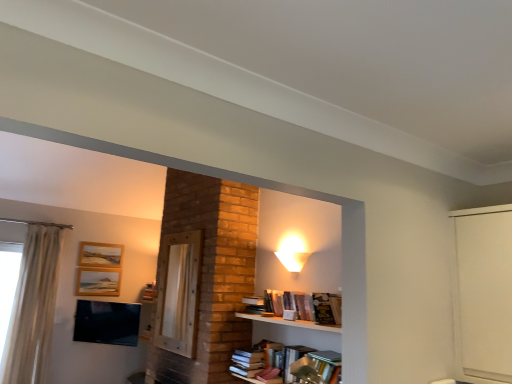
Describe the element at coordinates (106, 322) in the screenshot. I see `matte black tv at lower left` at that location.

What is the approximate height of white frosted glass lampshade at upper center?

white frosted glass lampshade at upper center is 9.31 inches in height.

Describe the element at coordinates (247, 362) in the screenshot. The image size is (512, 384). I see `hardcover books at center` at that location.

Find the location of a particular element. The image size is (512, 384). wooden picture frame at upper left, acting as the 2th picture frame starting from the bottom is located at coordinates (100, 254).

Is hardcover books at center not close to white frosted glass lampshade at upper center?

No, hardcover books at center is not far away from white frosted glass lampshade at upper center.

In terms of width, does hardcover books at center look wider or thinner when compared to white frosted glass lampshade at upper center?

Clearly, hardcover books at center has more width compared to white frosted glass lampshade at upper center.

Looking at this image, measure the distance from hardcover books at center to white frosted glass lampshade at upper center.

hardcover books at center and white frosted glass lampshade at upper center are 32.13 inches apart from each other.

Which is behind, point (243, 364) or point (288, 264)?

The point (288, 264) is farther.

Is white sheer curtain at left a part of matte black tv at lower left?

Answer: No, matte black tv at lower left does not contain white sheer curtain at left.

Which object is positioned more to the right, matte black tv at lower left or white sheer curtain at left?

matte black tv at lower left.

How far apart are matte black tv at lower left and white sheer curtain at left?

A distance of 58.07 centimeters exists between matte black tv at lower left and white sheer curtain at left.

Is matte black tv at lower left far from white sheer curtain at left?

No, matte black tv at lower left is not far away from white sheer curtain at left.

Is wooden picture frame at upper left, marked as the 1th picture frame in a top-to-bottom arrangement, with matte black tv at lower left?

No, wooden picture frame at upper left, marked as the 1th picture frame in a top-to-bottom arrangement, is not with matte black tv at lower left.

Which of these two, wooden picture frame at upper left, marked as the 1th picture frame in a top-to-bottom arrangement, or matte black tv at lower left, is bigger?

Bigger between the two is matte black tv at lower left.

Looking at this image, is wooden picture frame at upper left, marked as the 1th picture frame in a top-to-bottom arrangement, spatially inside matte black tv at lower left, or outside of it?

wooden picture frame at upper left, marked as the 1th picture frame in a top-to-bottom arrangement, is not inside matte black tv at lower left, it's outside.

From the image's perspective, which one is positioned higher, wooden picture frame at upper left, acting as the 2th picture frame starting from the bottom, or matte black tv at lower left?

wooden picture frame at upper left, acting as the 2th picture frame starting from the bottom.

In the scene shown: How much distance is there between wooden picture frame at upper left, acting as the 2th picture frame starting from the bottom, and white frosted glass lampshade at upper center?

wooden picture frame at upper left, acting as the 2th picture frame starting from the bottom, and white frosted glass lampshade at upper center are 2.82 meters apart from each other.

Would you say wooden picture frame at upper left, acting as the 2th picture frame starting from the bottom, is outside white frosted glass lampshade at upper center?

Indeed, wooden picture frame at upper left, acting as the 2th picture frame starting from the bottom, is completely outside white frosted glass lampshade at upper center.

Is wooden picture frame at upper left, marked as the 1th picture frame in a top-to-bottom arrangement, closer to the viewer compared to white frosted glass lampshade at upper center?

No, wooden picture frame at upper left, marked as the 1th picture frame in a top-to-bottom arrangement, is behind white frosted glass lampshade at upper center.

Is wooden picture frame at upper left, marked as the 1th picture frame in a top-to-bottom arrangement, wider or thinner than white frosted glass lampshade at upper center?

In the image, wooden picture frame at upper left, marked as the 1th picture frame in a top-to-bottom arrangement, appears to be more narrow than white frosted glass lampshade at upper center.

At what (x,y) coordinates should I click in order to perform the action: click on the 2nd picture frame counting from the right of the white sheer curtain at left. Please return your answer as a coordinate pair (x, y). Looking at the image, I should click on (98, 281).

Which of these two, white sheer curtain at left or wooden picture frame at upper left, which appears as the 1th picture frame when ordered from the bottom, stands taller?

With more height is white sheer curtain at left.

From a real-world perspective, between white sheer curtain at left and wooden picture frame at upper left, which is the second picture frame in top-to-bottom order, who is vertically higher?

wooden picture frame at upper left, which is the second picture frame in top-to-bottom order.

Measure the distance from wooden picture frame at upper left, which appears as the 1th picture frame when ordered from the bottom, to hardcover books at center.

They are 8.24 feet apart.

Does wooden picture frame at upper left, which appears as the 1th picture frame when ordered from the bottom, have a greater height compared to hardcover books at center?

Indeed, wooden picture frame at upper left, which appears as the 1th picture frame when ordered from the bottom, has a greater height compared to hardcover books at center.

In terms of size, does wooden picture frame at upper left, which is the second picture frame in top-to-bottom order, appear bigger or smaller than hardcover books at center?

Considering their sizes, wooden picture frame at upper left, which is the second picture frame in top-to-bottom order, takes up less space than hardcover books at center.

From a real-world perspective, is wooden picture frame at upper left, which appears as the 1th picture frame when ordered from the bottom, positioned under hardcover books at center based on gravity?

No.

Considering the sizes of wooden picture frame at upper left, which appears as the 1th picture frame when ordered from the bottom, and white sheer curtain at left in the image, is wooden picture frame at upper left, which appears as the 1th picture frame when ordered from the bottom, taller or shorter than white sheer curtain at left?

Considering their sizes, wooden picture frame at upper left, which appears as the 1th picture frame when ordered from the bottom, has less height than white sheer curtain at left.

Can you tell me how much wooden picture frame at upper left, which appears as the 1th picture frame when ordered from the bottom, and white sheer curtain at left differ in facing direction?

The angular difference between wooden picture frame at upper left, which appears as the 1th picture frame when ordered from the bottom, and white sheer curtain at left is 0.00266 degrees.

From the white sheer curtain at left, count 1st picture frames backward and point to it. Please provide its 2D coordinates.

[(98, 281)]

In the scene shown: Are wooden picture frame at upper left, which is the second picture frame in top-to-bottom order, and white sheer curtain at left beside each other?

wooden picture frame at upper left, which is the second picture frame in top-to-bottom order, and white sheer curtain at left are clearly separated.

Image resolution: width=512 pixels, height=384 pixels. I want to click on book that is below the white frosted glass lampshade at upper center (from the image's perspective), so click(247, 362).

You are a GUI agent. You are given a task and a screenshot of the screen. Output one action in this format:
    pyautogui.click(x=<x>, y=<y>)
    Task: Click on the curtain above the matte black tv at lower left (from a real-world perspective)
    The height and width of the screenshot is (384, 512).
    Given the screenshot: What is the action you would take?
    pyautogui.click(x=33, y=308)

Based on their spatial positions, is white frosted glass lampshade at upper center or matte black tv at lower left further from white sheer curtain at left?

Among the two, white frosted glass lampshade at upper center is located further to white sheer curtain at left.

Which object lies further to the anchor point matte black tv at lower left, white sheer curtain at left or wooden picture frame at upper left, which is the second picture frame in top-to-bottom order?

white sheer curtain at left.

Estimate the real-world distances between objects in this image. Which object is further from wooden picture frame at upper left, which appears as the 1th picture frame when ordered from the bottom, hardcover books at center or matte black tv at lower left?

Among the two, hardcover books at center is located further to wooden picture frame at upper left, which appears as the 1th picture frame when ordered from the bottom.

Which object lies nearer to the anchor point wooden picture frame at upper left, marked as the 1th picture frame in a top-to-bottom arrangement, wooden picture frame at upper left, which appears as the 1th picture frame when ordered from the bottom, or hardcover books at center?

wooden picture frame at upper left, which appears as the 1th picture frame when ordered from the bottom, lies closer to wooden picture frame at upper left, marked as the 1th picture frame in a top-to-bottom arrangement, than the other object.

Estimate the real-world distances between objects in this image. Which object is further from white sheer curtain at left, white frosted glass lampshade at upper center or hardcover books at center?

white frosted glass lampshade at upper center is positioned further to the anchor white sheer curtain at left.

Considering their positions, is matte black tv at lower left positioned closer to white frosted glass lampshade at upper center than white sheer curtain at left?

Based on the image, matte black tv at lower left appears to be nearer to white frosted glass lampshade at upper center.

Looking at the image, which one is located further to wooden picture frame at upper left, marked as the 1th picture frame in a top-to-bottom arrangement, white frosted glass lampshade at upper center or wooden picture frame at upper left, which appears as the 1th picture frame when ordered from the bottom?

white frosted glass lampshade at upper center is positioned further to the anchor wooden picture frame at upper left, marked as the 1th picture frame in a top-to-bottom arrangement.

Estimate the real-world distances between objects in this image. Which object is closer to wooden picture frame at upper left, which appears as the 1th picture frame when ordered from the bottom, white sheer curtain at left or matte black tv at lower left?

The object closer to wooden picture frame at upper left, which appears as the 1th picture frame when ordered from the bottom, is matte black tv at lower left.

Identify the location of picture frame between white sheer curtain at left and wooden picture frame at upper left, marked as the 1th picture frame in a top-to-bottom arrangement, from front to back. The width and height of the screenshot is (512, 384). (98, 281).

The width and height of the screenshot is (512, 384). Identify the location of book situated between matte black tv at lower left and white frosted glass lampshade at upper center from left to right. (247, 362).

What are the coordinates of `television located between white sheer curtain at left and wooden picture frame at upper left, which appears as the 1th picture frame when ordered from the bottom, in the depth direction` in the screenshot? It's located at (106, 322).

What are the coordinates of `picture frame between wooden picture frame at upper left, marked as the 1th picture frame in a top-to-bottom arrangement, and matte black tv at lower left vertically` in the screenshot? It's located at (98, 281).